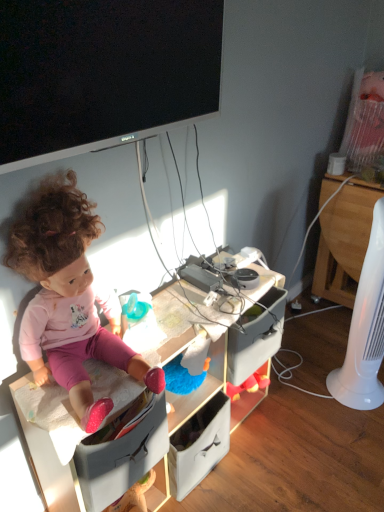
Locate an element on the screen. The image size is (384, 512). vacant space behind white plastic fan at right is located at coordinates (319, 352).